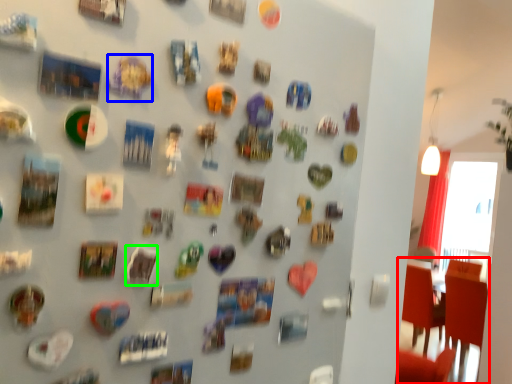
Question: Which is nearer to the chair (highlighted by a red box)? art (highlighted by a blue box) or art (highlighted by a green box).

Choices:
 (A) art
 (B) art

Answer: (B)